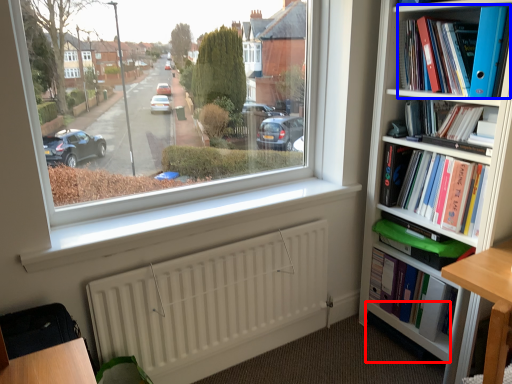
Question: Which of the following is the closest to the observer, shelf (highlighted by a red box) or book (highlighted by a blue box)?

Choices:
 (A) shelf
 (B) book

Answer: (B)